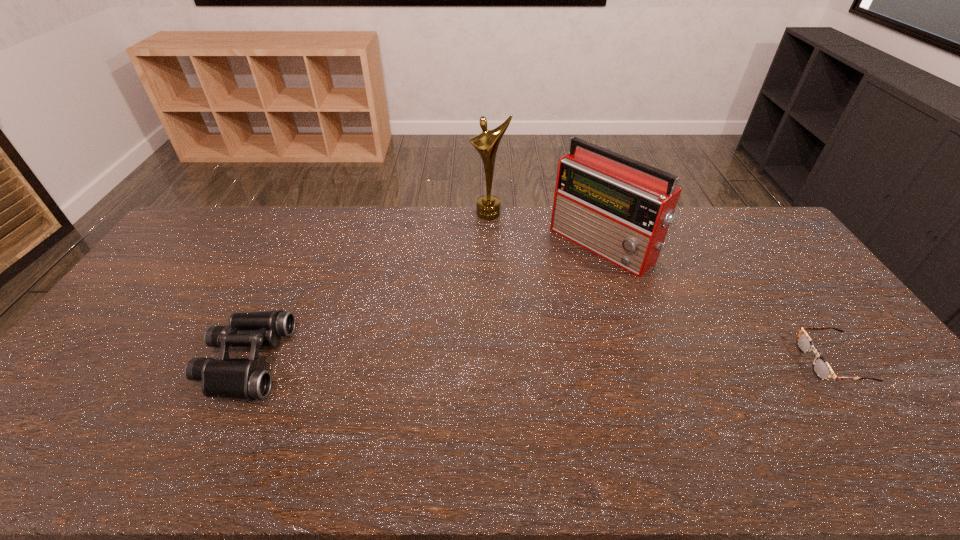
Find the location of a particular element. The image size is (960, 540). the leftmost object is located at coordinates (235, 378).

This screenshot has width=960, height=540. Identify the location of the third tallest object. (235, 378).

Image resolution: width=960 pixels, height=540 pixels. Find the location of `the rightmost object`. the rightmost object is located at coordinates 821,368.

You are a GUI agent. You are given a task and a screenshot of the screen. Output one action in this format:
    pyautogui.click(x=<x>, y=<y>)
    Task: Click on the spectacles
    The image size is (960, 540).
    Given the screenshot: What is the action you would take?
    pyautogui.click(x=821, y=368)

Find the location of a particular element. Image resolution: width=960 pixels, height=540 pixels. radio receiver is located at coordinates [x=620, y=209].

This screenshot has width=960, height=540. Find the location of `the second object from left to right`. the second object from left to right is located at coordinates (488, 206).

Find the location of a particular element. This screenshot has width=960, height=540. vacant region located on the front-facing side of the second shortest object is located at coordinates (353, 361).

This screenshot has height=540, width=960. I want to click on free space located 0.070m on the frame of the spectacles, so click(x=780, y=362).

The width and height of the screenshot is (960, 540). Find the location of `vacant space located 0.280m on the frame of the spectacles`. vacant space located 0.280m on the frame of the spectacles is located at coordinates (703, 362).

In order to click on vacant space located 0.370m on the frame of the spectacles in this screenshot , I will do `click(669, 362)`.